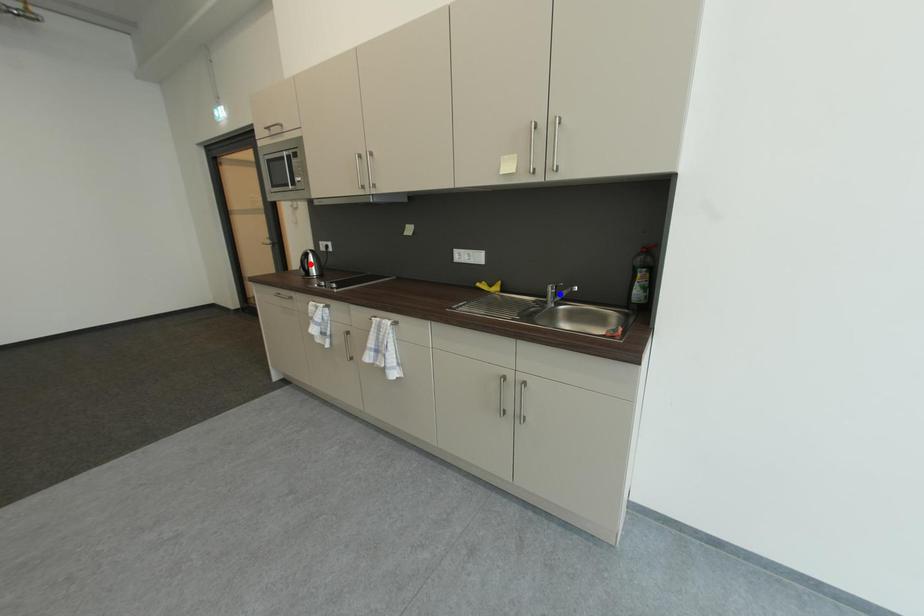
Question: Which of the two points in the image is closer to the camera?

Choices:
 (A) Blue point is closer.
 (B) Red point is closer.

Answer: (A)